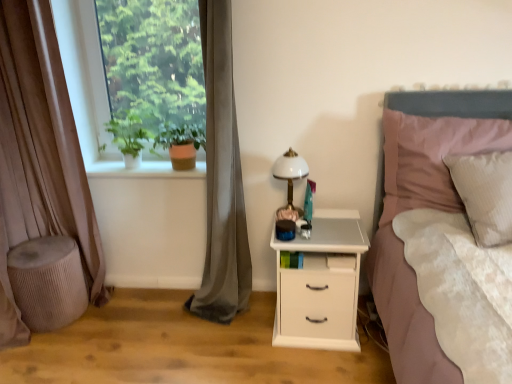
Identify the location of free location in front of brown velvet curtain at left, the 2th curtain when ordered from right to left. (67, 342).